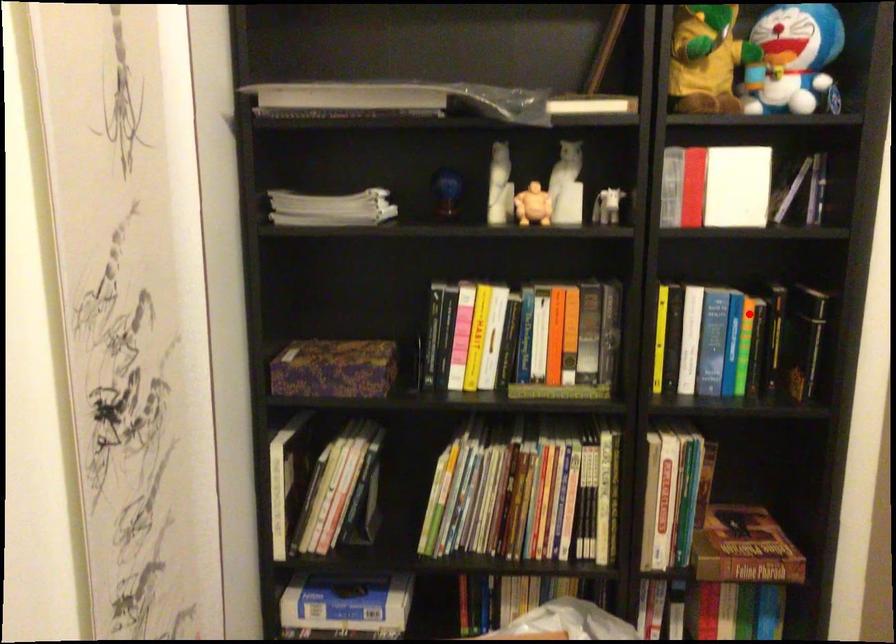
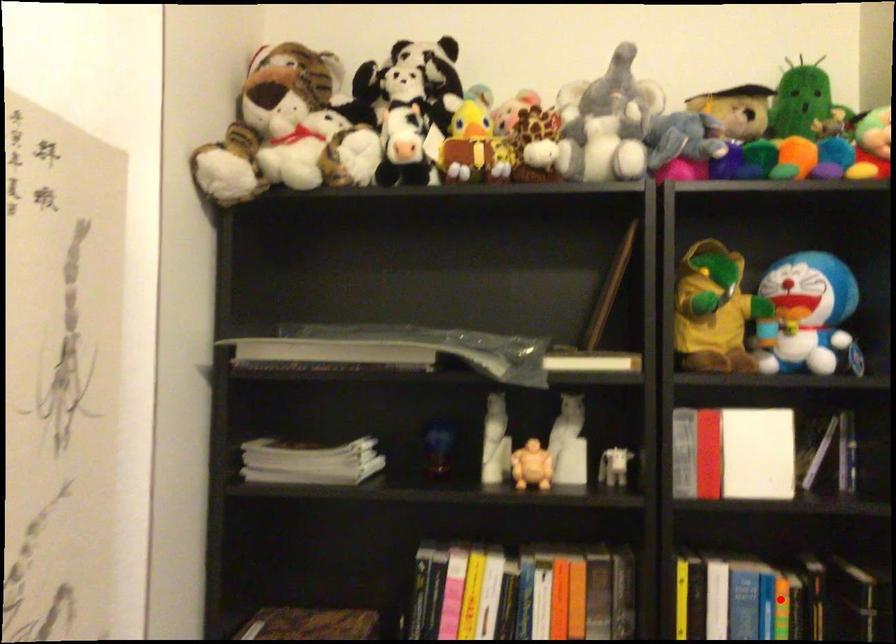
I am providing you with two images of the same scene from different viewpoints. A red point is marked on the first image and another point is marked on the second image. Do the highlighted points in image1 and image2 indicate the same real-world spot?

Yes